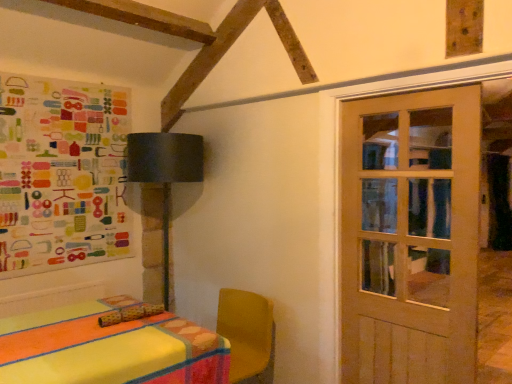
I want to click on free space above wooden door at right (from a real-world perspective), so click(400, 96).